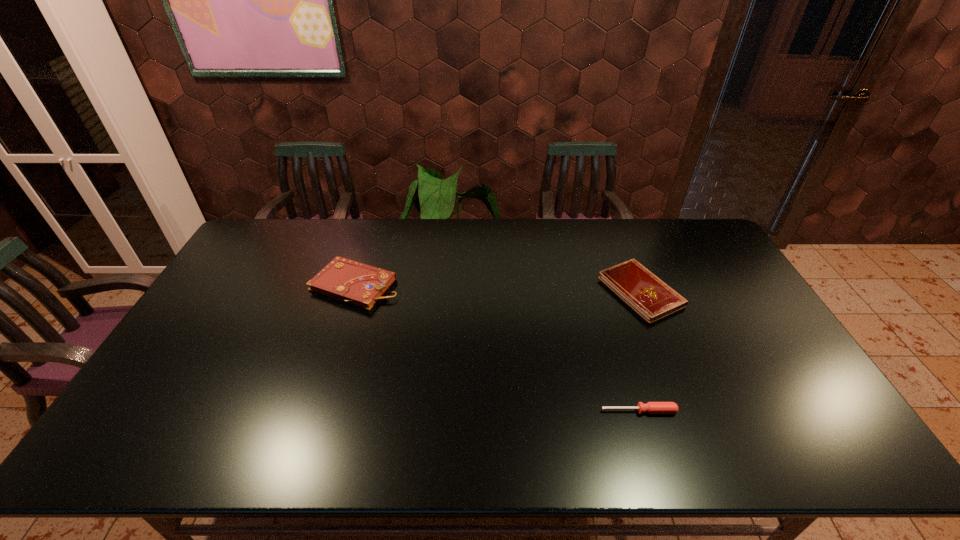
Where is `empty space between the right notebook and the screwdriver`? This screenshot has height=540, width=960. empty space between the right notebook and the screwdriver is located at coordinates (639, 351).

Identify the location of object that is the closest to the right notebook. (651, 407).

Where is `object that is the closest to the right notebook`? object that is the closest to the right notebook is located at coordinates (651, 407).

Where is `vacant position in the image that satisfies the following two spatial constraints: 1. on the front side of the right notebook; 2. on the right side of the leftmost object`? vacant position in the image that satisfies the following two spatial constraints: 1. on the front side of the right notebook; 2. on the right side of the leftmost object is located at coordinates pyautogui.click(x=353, y=291).

Where is `free space that satisfies the following two spatial constraints: 1. on the front side of the screwdriver; 2. on the left side of the tallest object`? free space that satisfies the following two spatial constraints: 1. on the front side of the screwdriver; 2. on the left side of the tallest object is located at coordinates tap(315, 411).

Locate an element on the screen. The height and width of the screenshot is (540, 960). blank space that satisfies the following two spatial constraints: 1. on the back side of the screwdriver; 2. on the right side of the shorter notebook is located at coordinates (602, 291).